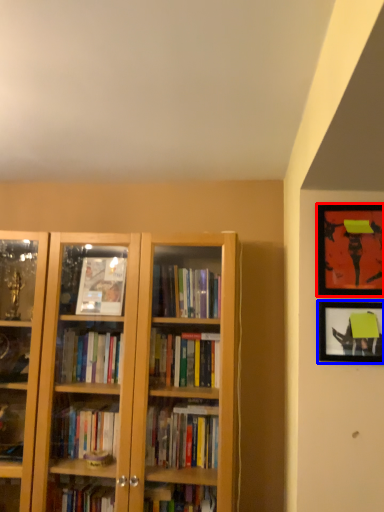
Question: Among these objects, which one is nearest to the camera, picture frame (highlighted by a red box) or picture frame (highlighted by a blue box)?

Choices:
 (A) picture frame
 (B) picture frame

Answer: (A)